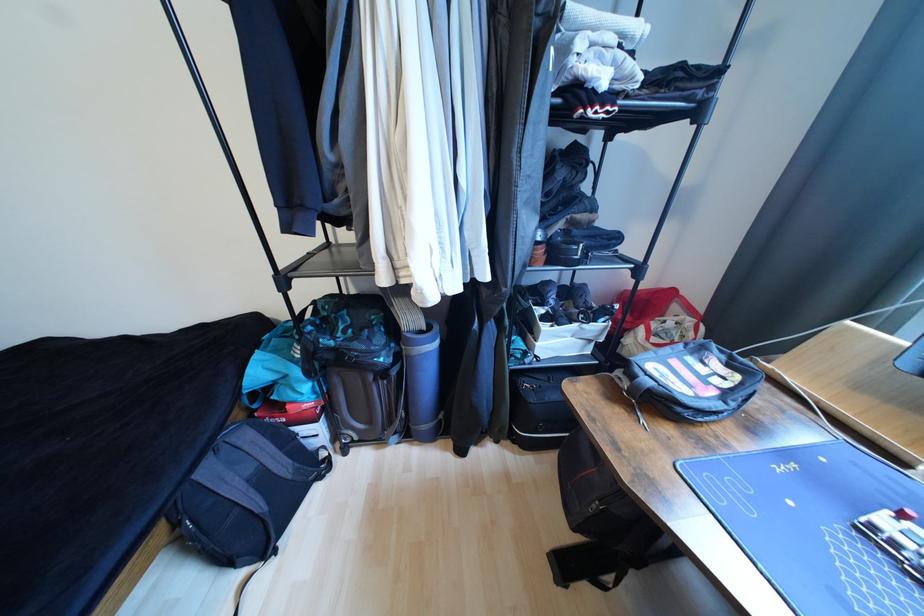
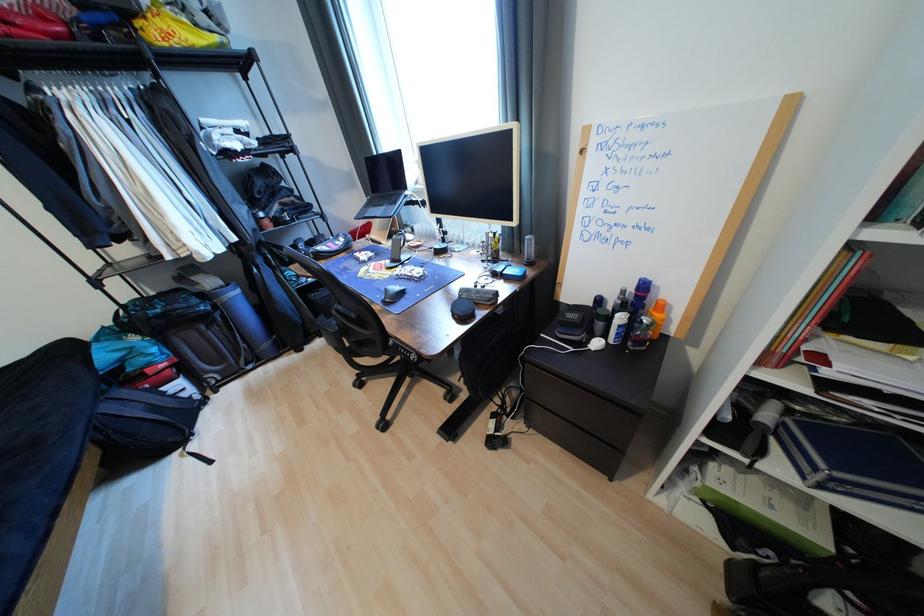
In the second image, find the point that corresponds to [215,472] in the first image.

(116, 408)